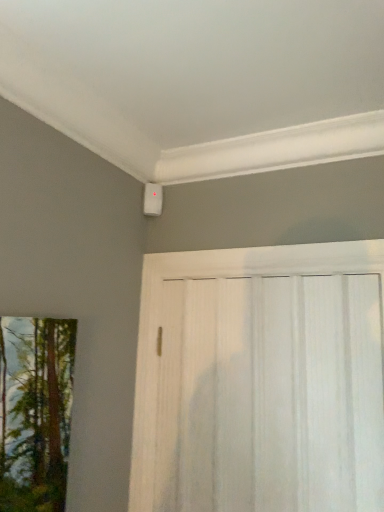
In order to face white textured barn door at lower right, should I rotate leftwards or rightwards?

You should look right and rotate roughly 8.451 degrees.

What do you see at coordinates (219, 277) in the screenshot? I see `white textured barn door at lower right` at bounding box center [219, 277].

Find the location of a particular element. The height and width of the screenshot is (512, 384). white textured barn door at lower right is located at coordinates (219, 277).

I want to click on white textured barn door at lower right, so click(x=219, y=277).